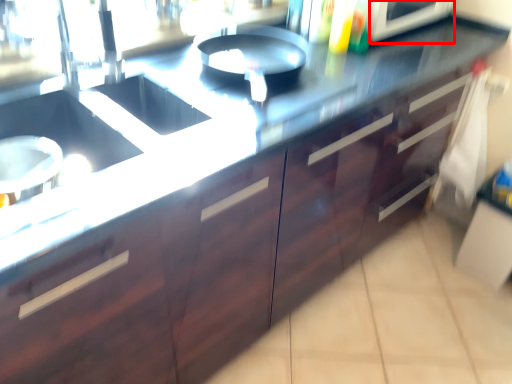
Question: From the image's perspective, where is appliance (annotated by the red box) located relative to drawer?

Choices:
 (A) below
 (B) above

Answer: (B)